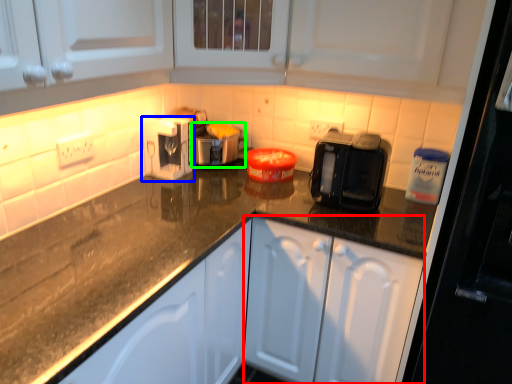
Question: Which object is positioned farthest from cabinetry (highlighted by a red box)? Select from kitchen appliance (highlighted by a blue box) and appliance (highlighted by a green box).

Choices:
 (A) kitchen appliance
 (B) appliance

Answer: (A)